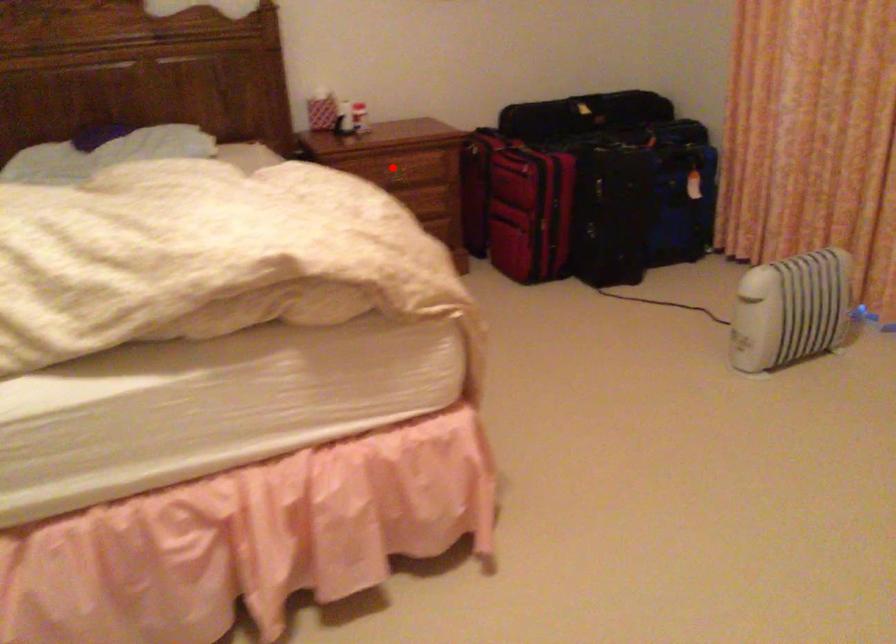
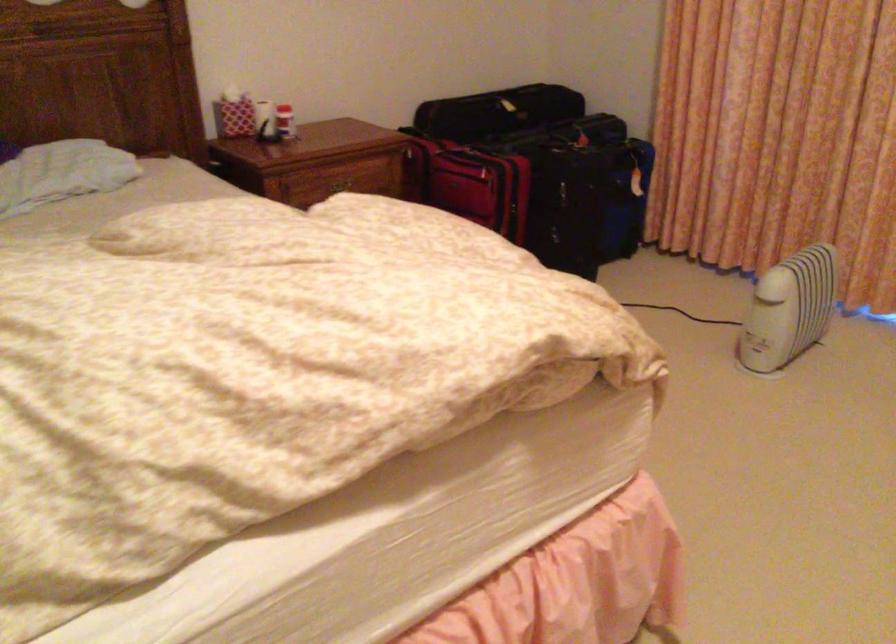
Where in the second image is the point corresponding to the highlighted location from the first image?

(338, 185)